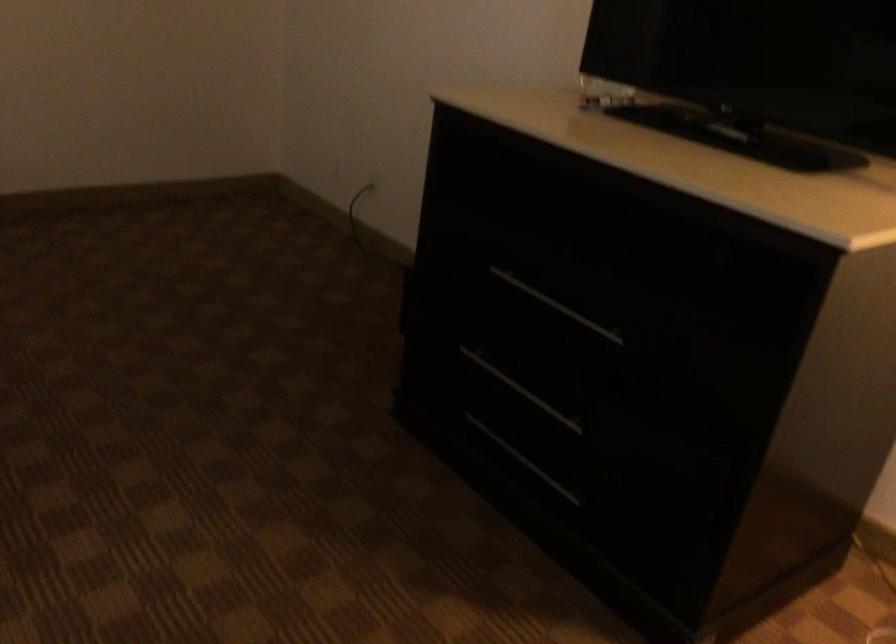
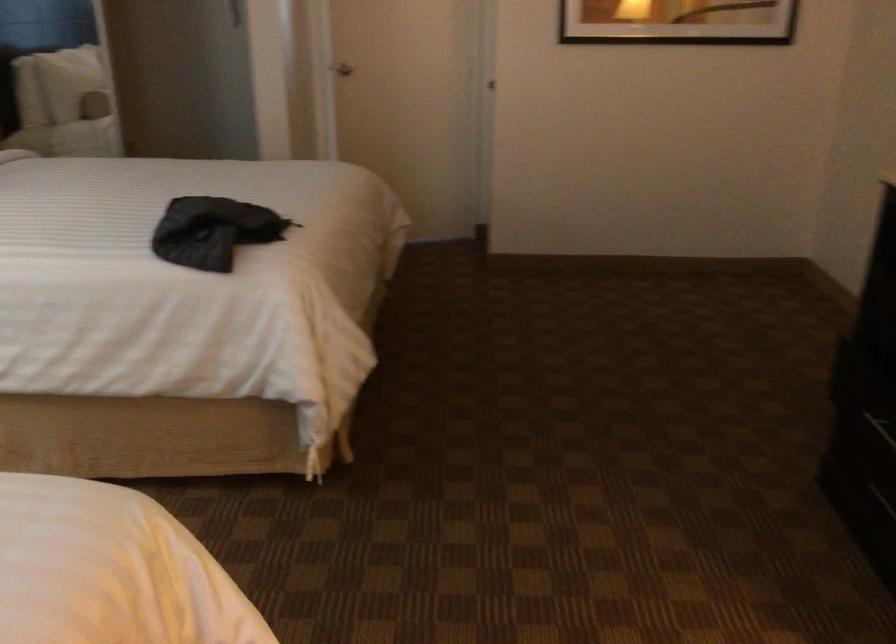
Question: The camera is either moving clockwise (left) or counter-clockwise (right) around the object. The first image is from the beginning of the video and the second image is from the end. Is the camera moving left or right when shooting the video?

Choices:
 (A) Left
 (B) Right

Answer: (B)